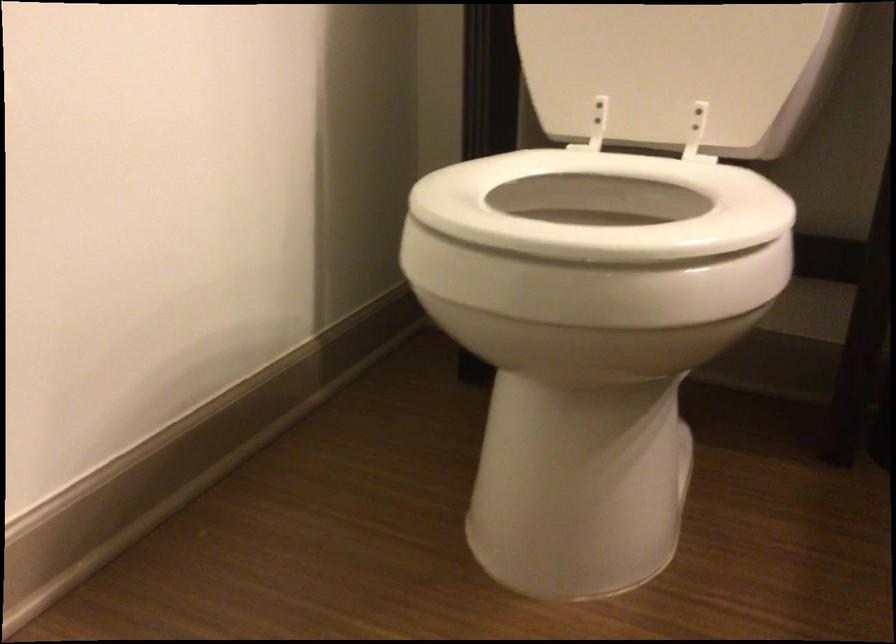
Where would you lift the white toilet seat? Please return your answer as a coordinate pair (x, y).

(602, 205)